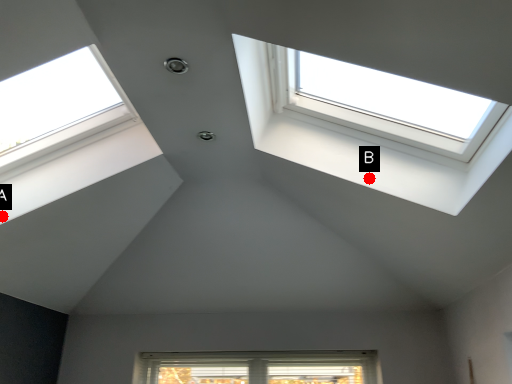
Question: Two points are circled on the image, labeled by A and B beside each circle. Among these points, which one is farthest from the camera?

Choices:
 (A) A is further
 (B) B is further

Answer: (A)